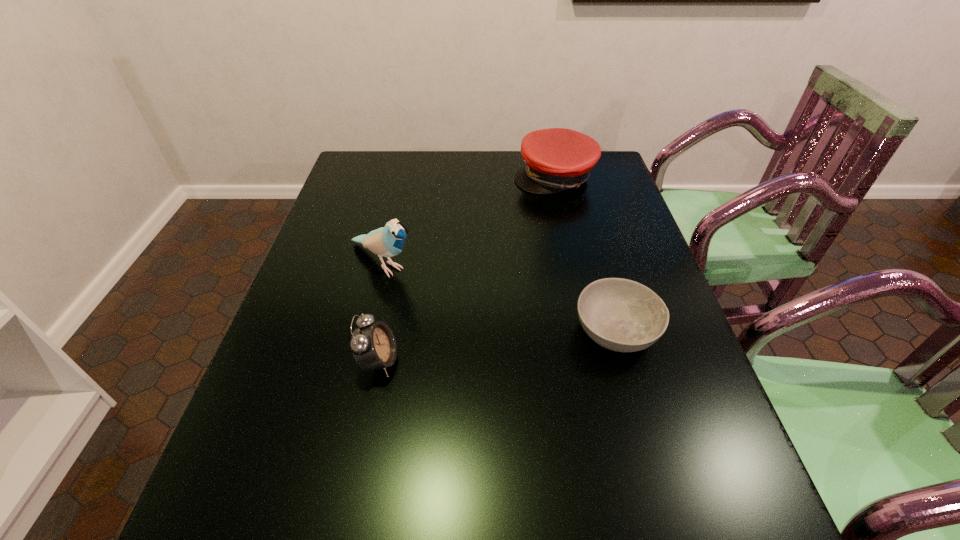
Where is `free space between the alarm clock and the second farthest object`? free space between the alarm clock and the second farthest object is located at coordinates (381, 312).

The height and width of the screenshot is (540, 960). In order to click on empty space between the alarm clock and the farthest object in this screenshot , I will do `click(467, 269)`.

I want to click on empty space that is in between the cap and the alarm clock, so click(x=467, y=269).

Image resolution: width=960 pixels, height=540 pixels. I want to click on empty space that is in between the shortest object and the cap, so click(585, 254).

Find the location of `free space between the tallest object and the farthest object`. free space between the tallest object and the farthest object is located at coordinates (468, 220).

Locate an element on the screen. The image size is (960, 540). free spot between the alarm clock and the tallest object is located at coordinates (381, 312).

Find the location of `object that is the second nearest to the farthest object`. object that is the second nearest to the farthest object is located at coordinates (622, 315).

Locate which object ranks in proximity to the alarm clock. Please provide its 2D coordinates. Your answer should be formatted as a tuple, i.e. [(x, y)], where the tuple contains the x and y coordinates of a point satisfying the conditions above.

[(388, 241)]

Identify the location of vacant space that satisfies the following two spatial constraints: 1. on the back side of the bird; 2. on the right side of the farthest object. The height and width of the screenshot is (540, 960). (403, 177).

This screenshot has width=960, height=540. In order to click on vacant space that satisfies the following two spatial constraints: 1. on the front side of the cap; 2. on the right side of the shortest object in this screenshot , I will do `click(589, 331)`.